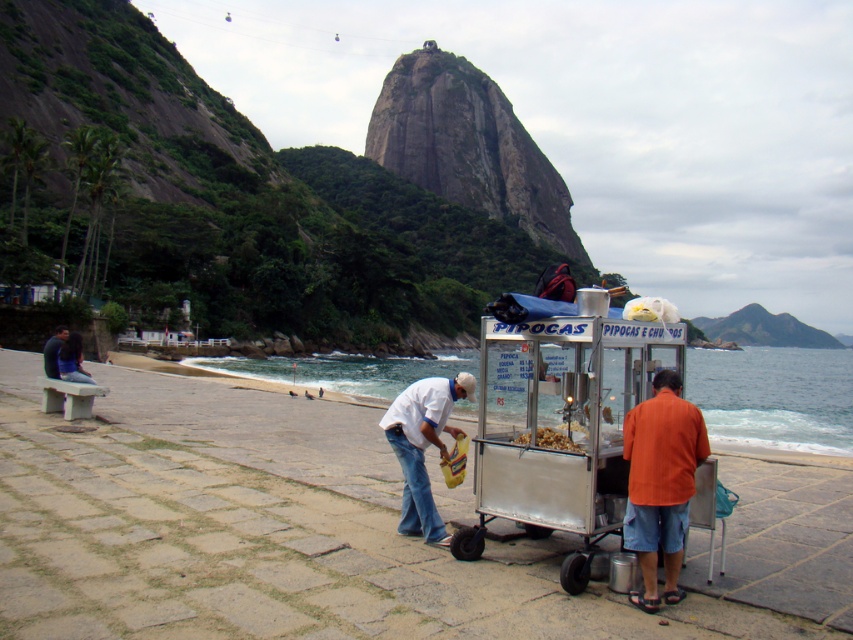
Question: Which object is the farthest from the orange linen shirt at lower right?

Choices:
 (A) white matte shirt at center
 (B) golden crispy popcorn at center
 (C) metallic silver cart at center
 (D) smooth sand at lower center

Answer: (D)

Question: Can you confirm if white matte shirt at center is positioned to the right of golden crispy popcorn at center?

Choices:
 (A) yes
 (B) no

Answer: (B)

Question: Is smooth sand at lower center below golden crispy popcorn at center?

Choices:
 (A) yes
 (B) no

Answer: (A)

Question: Which object is the closest to the golden crispy popcorn at center?

Choices:
 (A) metallic silver cart at center
 (B) white matte shirt at center

Answer: (B)

Question: Which object appears closest to the camera in this image?

Choices:
 (A) white matte shirt at center
 (B) metallic silver cart at center

Answer: (B)

Question: Is orange linen shirt at lower right bigger than white matte shirt at center?

Choices:
 (A) yes
 (B) no

Answer: (B)